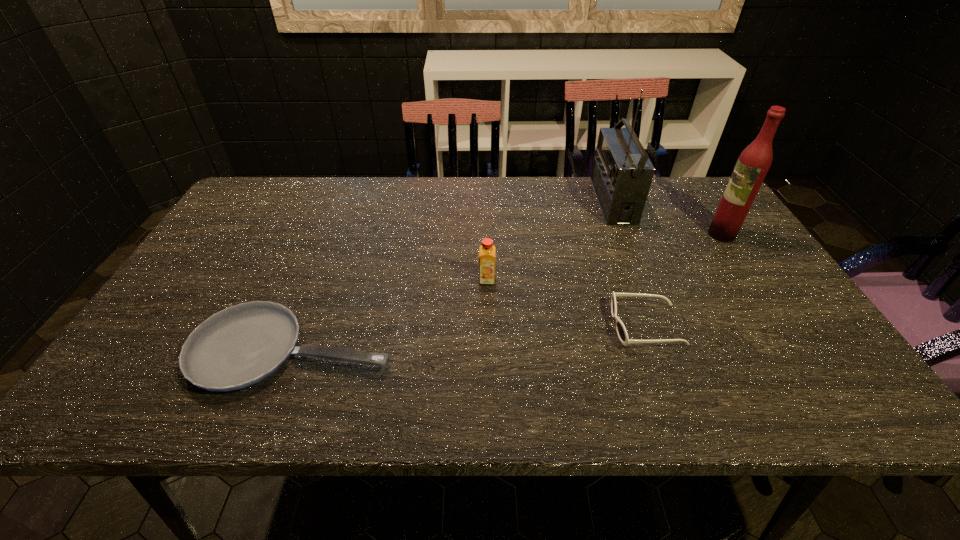
Choose which object is the nearest neighbor to the second object from left to right. Please provide its 2D coordinates. Your answer should be formatted as a tuple, i.e. [(x, y)], where the tuple contains the x and y coordinates of a point satisfying the conditions above.

[(242, 345)]

Locate an element on the screen. The width and height of the screenshot is (960, 540). vacant space that satisfies the following two spatial constraints: 1. on the front panel of the radio receiver; 2. on the front and back of the second object from left to right is located at coordinates (643, 280).

Where is `free point that satisfies the following two spatial constraints: 1. on the front panel of the radio receiver; 2. on the front and back of the second object from left to right`? free point that satisfies the following two spatial constraints: 1. on the front panel of the radio receiver; 2. on the front and back of the second object from left to right is located at coordinates (643, 280).

Find the location of a particular element. This screenshot has width=960, height=540. free location that satisfies the following two spatial constraints: 1. on the front panel of the radio receiver; 2. on the front and back of the orange juice is located at coordinates (643, 280).